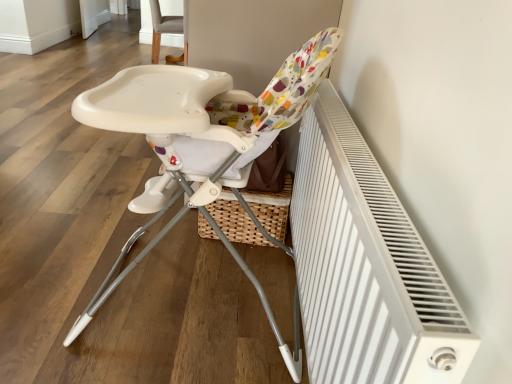
Question: Are white plastic highchair at center, positioned as the first chair in front-to-back order, and white textured radiator at right far apart?

Choices:
 (A) yes
 (B) no

Answer: (B)

Question: Considering the relative sizes of white plastic highchair at center, the 2th chair from the back, and white textured radiator at right in the image provided, is white plastic highchair at center, the 2th chair from the back, wider than white textured radiator at right?

Choices:
 (A) no
 (B) yes

Answer: (B)

Question: Is the depth of white plastic highchair at center, the 2th chair from the back, greater than that of white textured radiator at right?

Choices:
 (A) yes
 (B) no

Answer: (A)

Question: Does white plastic highchair at center, the 2th chair from the back, lie in front of white textured radiator at right?

Choices:
 (A) no
 (B) yes

Answer: (A)

Question: Considering the relative sizes of white plastic highchair at center, the 2th chair from the back, and white textured radiator at right in the image provided, is white plastic highchair at center, the 2th chair from the back, shorter than white textured radiator at right?

Choices:
 (A) no
 (B) yes

Answer: (B)

Question: Is white plastic highchair at center, positioned as the first chair in front-to-back order, looking in the opposite direction of white textured radiator at right?

Choices:
 (A) no
 (B) yes

Answer: (A)

Question: Does gray fabric chair at upper center, the 1th chair from the back, have a greater height compared to white textured radiator at right?

Choices:
 (A) no
 (B) yes

Answer: (B)

Question: Is white textured radiator at right a part of gray fabric chair at upper center, the 1th chair from the back?

Choices:
 (A) yes
 (B) no

Answer: (B)

Question: Does gray fabric chair at upper center, the second chair from the front, turn towards white textured radiator at right?

Choices:
 (A) no
 (B) yes

Answer: (A)

Question: Is gray fabric chair at upper center, the second chair from the front, far from white textured radiator at right?

Choices:
 (A) no
 (B) yes

Answer: (B)

Question: From a real-world perspective, is gray fabric chair at upper center, the 1th chair from the back, located beneath white textured radiator at right?

Choices:
 (A) no
 (B) yes

Answer: (B)

Question: From the image's perspective, does gray fabric chair at upper center, the 1th chair from the back, appear lower than white textured radiator at right?

Choices:
 (A) yes
 (B) no

Answer: (B)

Question: Can we say white plastic highchair at center, the 2th chair from the back, lies outside gray fabric chair at upper center, the 1th chair from the back?

Choices:
 (A) yes
 (B) no

Answer: (A)